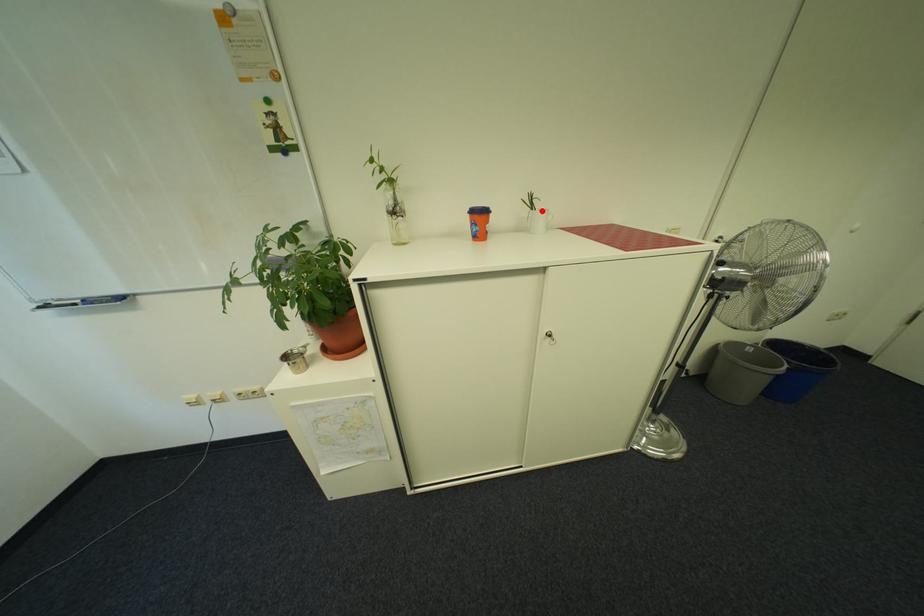
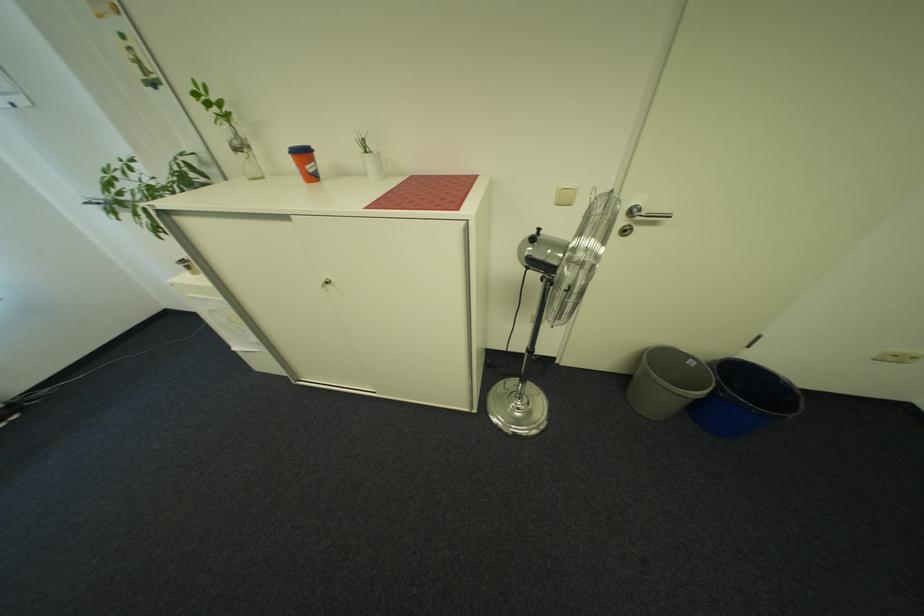
Locate, in the second image, the point that corresponds to the highlighted location in the first image.

(375, 153)